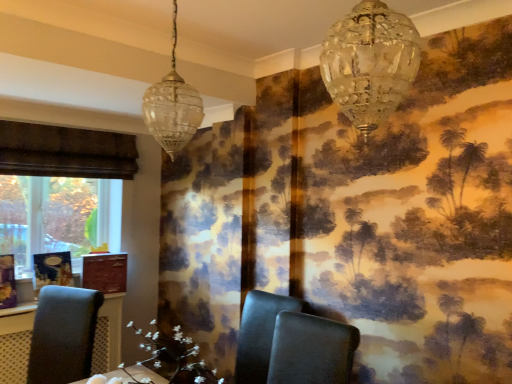
Question: From the image's perspective, is matte black chair at left, the third chair when ordered from right to left, under black leather chair at center, the 2th chair viewed from the right?

Choices:
 (A) yes
 (B) no

Answer: (A)

Question: Is matte black chair at left, the 1th chair in the left-to-right sequence, positioned before black leather chair at center, the 2th chair viewed from the right?

Choices:
 (A) no
 (B) yes

Answer: (A)

Question: From the image's perspective, would you say matte black chair at left, the third chair when ordered from right to left, is positioned over black leather chair at center, placed as the 2th chair when sorted from left to right?

Choices:
 (A) yes
 (B) no

Answer: (B)

Question: Is black leather chair at center, the 2th chair viewed from the right, surrounded by matte black chair at left, the third chair when ordered from right to left?

Choices:
 (A) yes
 (B) no

Answer: (B)

Question: Is black leather chair at center, the 2th chair viewed from the right, at the back of matte black chair at left, the third chair when ordered from right to left?

Choices:
 (A) no
 (B) yes

Answer: (A)

Question: Is matte black chair at left, the third chair when ordered from right to left, behind black leather chair at center, placed as the 2th chair when sorted from left to right?

Choices:
 (A) no
 (B) yes

Answer: (B)

Question: Can you confirm if black leather chair at center, placed as the 2th chair when sorted from left to right, is taller than matte black chair at left, the third chair when ordered from right to left?

Choices:
 (A) no
 (B) yes

Answer: (A)

Question: Is black leather chair at center, the 2th chair viewed from the right, oriented away from matte black chair at left, the 1th chair in the left-to-right sequence?

Choices:
 (A) yes
 (B) no

Answer: (B)

Question: Can we say black leather chair at center, placed as the 2th chair when sorted from left to right, lies outside matte black chair at left, the 1th chair in the left-to-right sequence?

Choices:
 (A) yes
 (B) no

Answer: (A)

Question: Considering the relative positions of black leather chair at center, placed as the 2th chair when sorted from left to right, and matte black chair at left, the third chair when ordered from right to left, in the image provided, is black leather chair at center, placed as the 2th chair when sorted from left to right, to the right of matte black chair at left, the third chair when ordered from right to left, from the viewer's perspective?

Choices:
 (A) yes
 (B) no

Answer: (A)

Question: Can you confirm if black leather chair at center, the 2th chair viewed from the right, is wider than matte black chair at left, the third chair when ordered from right to left?

Choices:
 (A) yes
 (B) no

Answer: (A)

Question: Are black leather chair at center, the 2th chair viewed from the right, and matte black chair at left, the third chair when ordered from right to left, beside each other?

Choices:
 (A) yes
 (B) no

Answer: (B)

Question: Considering the relative positions of crystal glass chandelier at upper center, which is counted as the first lamp, starting from the right, and black leather chair at center, placed as the 2th chair when sorted from left to right, in the image provided, is crystal glass chandelier at upper center, which is counted as the first lamp, starting from the right, to the left of black leather chair at center, placed as the 2th chair when sorted from left to right, from the viewer's perspective?

Choices:
 (A) yes
 (B) no

Answer: (B)